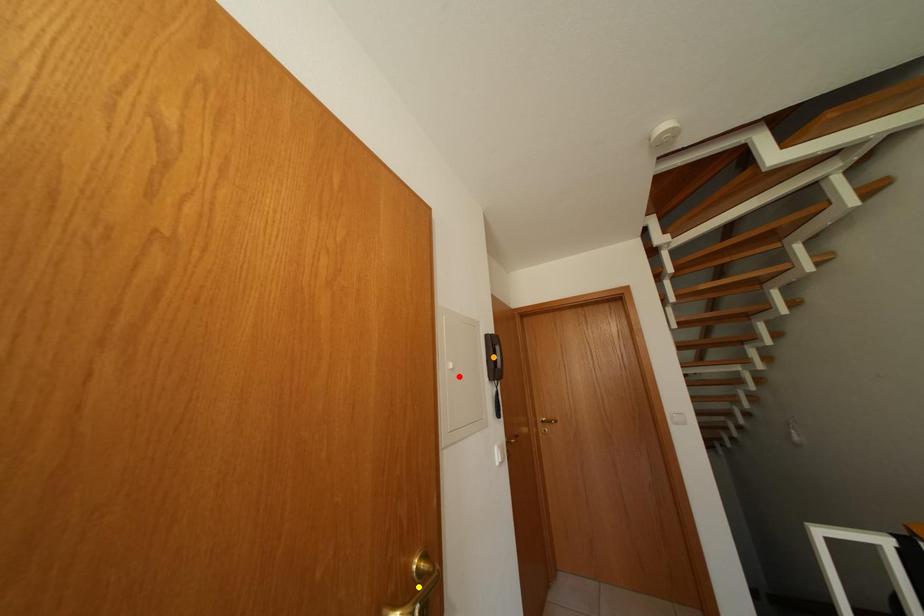
Order these from nearest to farthest:
- red point
- orange point
- yellow point

1. yellow point
2. red point
3. orange point